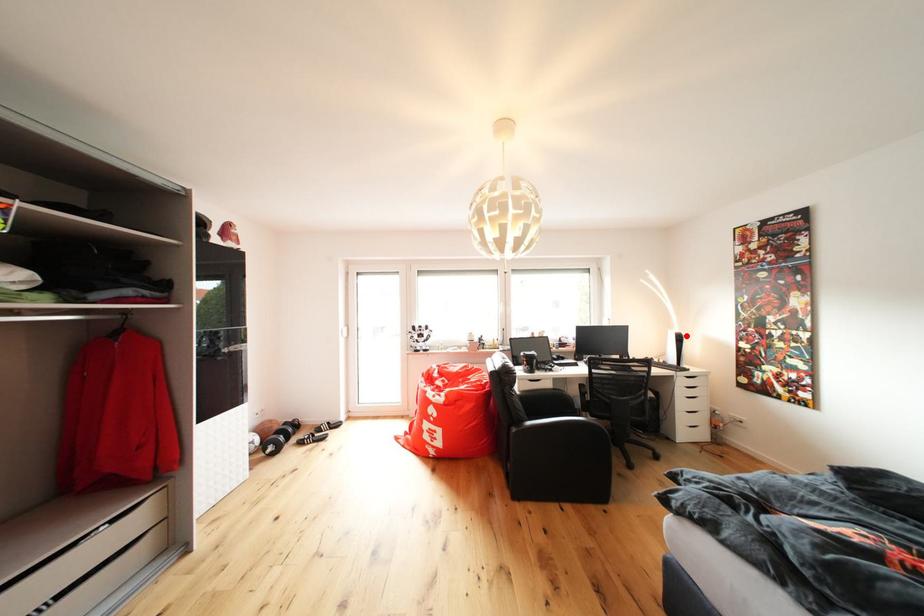
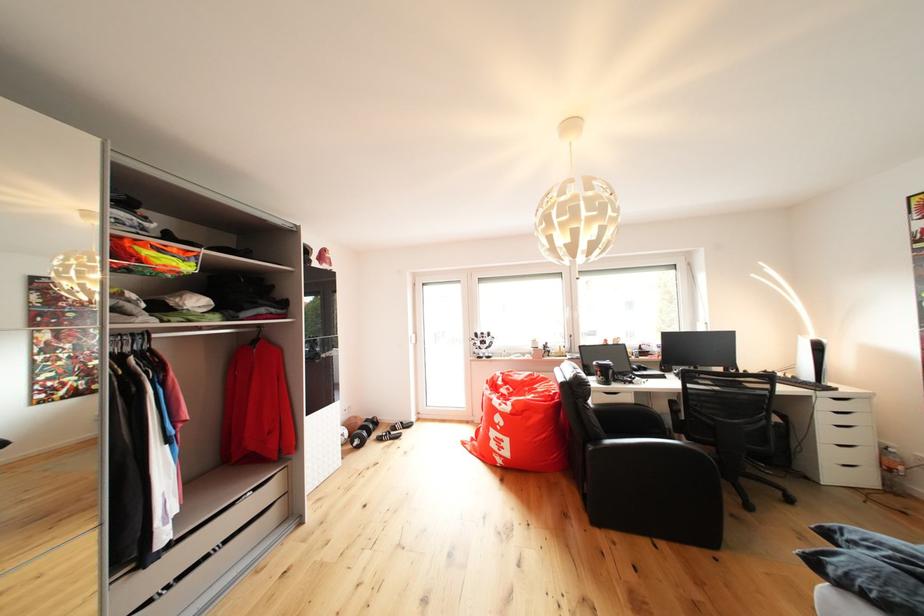
The point at the highlighted location is marked in the first image. Where is the corresponding point in the second image?

(822, 342)